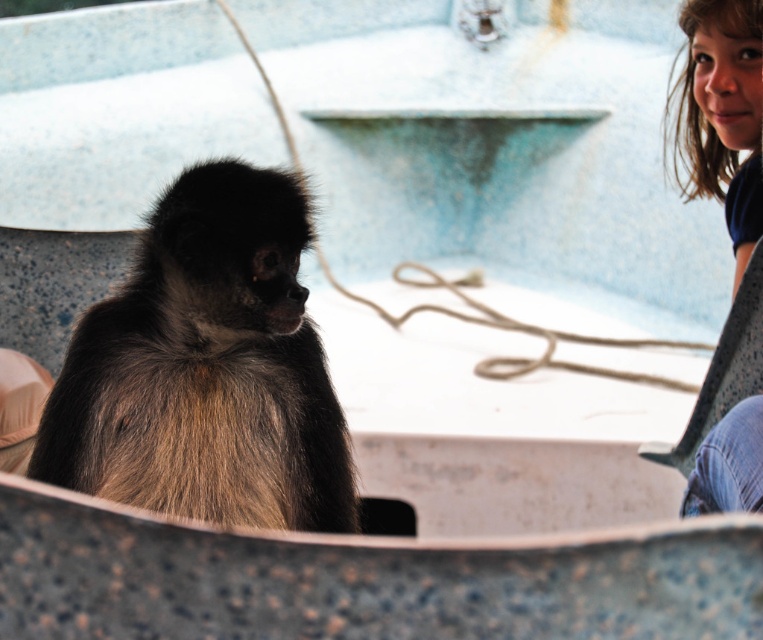
From the picture: Does brown furry monkey at center have a greater width compared to blue denim jeans at lower right?

Yes, brown furry monkey at center is wider than blue denim jeans at lower right.

Can you confirm if brown furry monkey at center is positioned below blue denim jeans at lower right?

Indeed, brown furry monkey at center is positioned under blue denim jeans at lower right.

Is point (105, 477) farther from camera compared to point (723, 32)?

No, it is in front of (723, 32).

In order to click on brown furry monkey at center in this screenshot , I will do tap(205, 369).